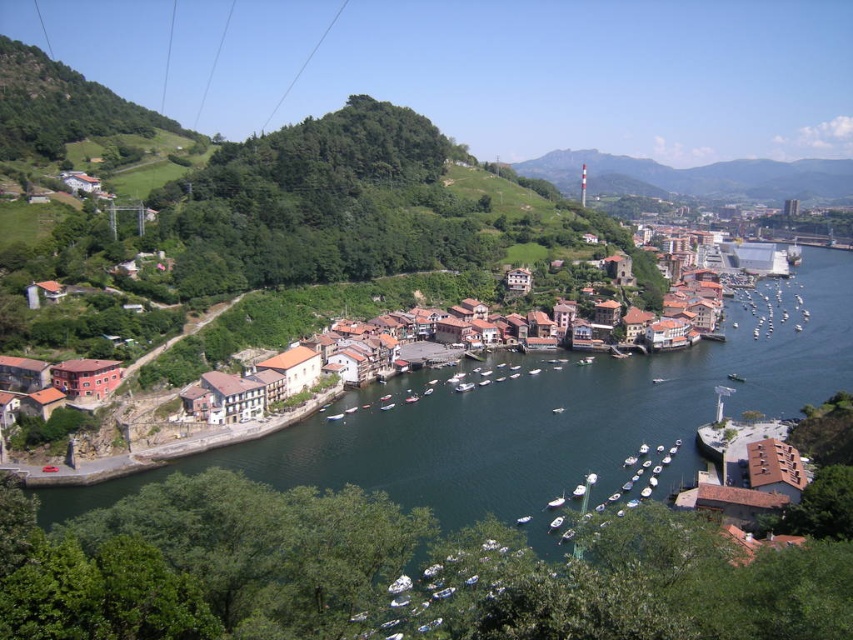
Which is more to the left, dark blue water at center or green grassy hillside at upper center?

Positioned to the left is dark blue water at center.

Which is in front, point (700, 346) or point (595, 168)?

Positioned in front is point (700, 346).

The height and width of the screenshot is (640, 853). Find the location of `dark blue water at center`. dark blue water at center is located at coordinates (548, 417).

Can you confirm if dark blue water at center is wider than brown wooden houses at center?

No.

Is point (703, 401) in front of point (627, 291)?

Yes, point (703, 401) is closer to viewer.

Where is `dark blue water at center`? dark blue water at center is located at coordinates (548, 417).

Is brown wooden houses at center to the right of green grassy hillside at upper center from the viewer's perspective?

No, brown wooden houses at center is not to the right of green grassy hillside at upper center.

The width and height of the screenshot is (853, 640). Identify the location of brown wooden houses at center. 303,310.